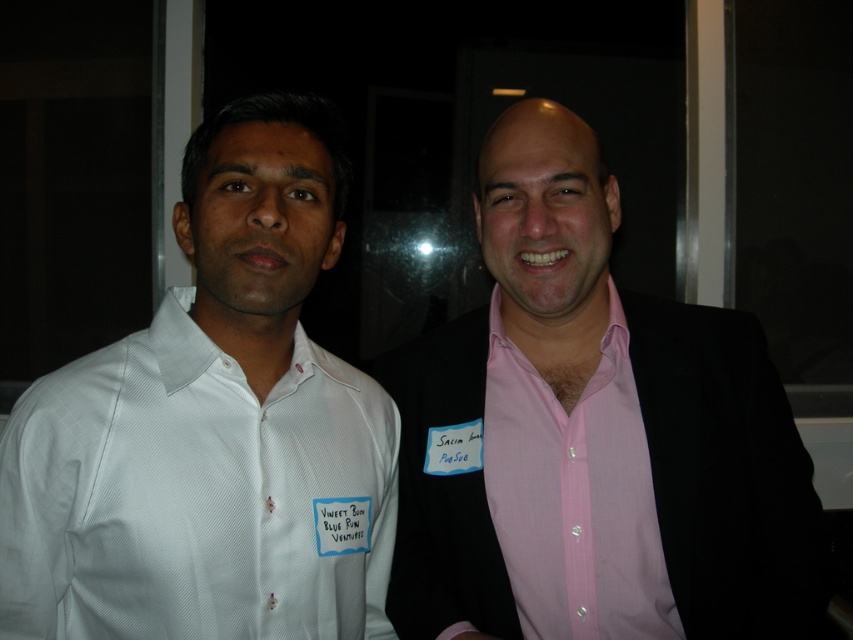
Between point (202, 147) and point (614, 593), which one is positioned behind?

The point (614, 593) is behind.

Who is lower down, white textured shirt at left or pink smooth shirt at right?

Positioned lower is pink smooth shirt at right.

The width and height of the screenshot is (853, 640). What are the coordinates of `white textured shirt at left` in the screenshot? It's located at (212, 428).

Which of these two, white textured shirt at left or pink satin shirt at center, stands taller?

With more height is pink satin shirt at center.

Does white textured shirt at left appear on the right side of pink satin shirt at center?

In fact, white textured shirt at left is to the left of pink satin shirt at center.

Where is `white textured shirt at left`? Image resolution: width=853 pixels, height=640 pixels. white textured shirt at left is located at coordinates (212, 428).

Can you confirm if pink satin shirt at center is bigger than pink smooth shirt at right?

Yes, pink satin shirt at center is bigger than pink smooth shirt at right.

Is point (495, 193) less distant than point (648, 609)?

No.

Between point (387, 372) and point (518, 593), which one is positioned in front?

Point (518, 593)

I want to click on pink satin shirt at center, so click(598, 416).